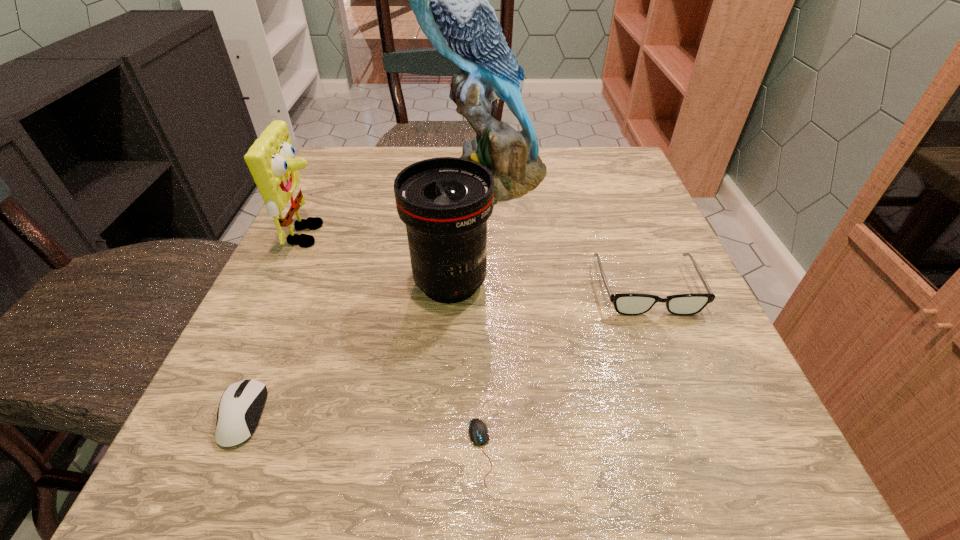
Where is `vacant area that lies between the tallest object and the left mouse`? This screenshot has width=960, height=540. vacant area that lies between the tallest object and the left mouse is located at coordinates (365, 298).

At what (x,y) coordinates should I click in order to perform the action: click on vacant area that lies between the shortest object and the third shortest object. Please return your answer as a coordinate pair (x, y). Image resolution: width=960 pixels, height=540 pixels. Looking at the image, I should click on (564, 370).

The height and width of the screenshot is (540, 960). What are the coordinates of `unoccupied position between the right mouse and the sponge` in the screenshot? It's located at (395, 343).

You are a GUI agent. You are given a task and a screenshot of the screen. Output one action in this format:
    pyautogui.click(x=<x>, y=<y>)
    Task: Click on the empty space that is in between the fifth tallest object and the shortest object
    This screenshot has height=540, width=960.
    Given the screenshot: What is the action you would take?
    pyautogui.click(x=361, y=434)

Where is `vacant region between the telephoto lens and the sponge`? The image size is (960, 540). vacant region between the telephoto lens and the sponge is located at coordinates (380, 259).

Image resolution: width=960 pixels, height=540 pixels. In order to click on object that is the nearest to the left mouse in this screenshot , I will do `click(445, 202)`.

Locate an element on the screen. Image resolution: width=960 pixels, height=540 pixels. the fourth closest object relative to the farthest object is located at coordinates (241, 404).

You are a GUI agent. You are given a task and a screenshot of the screen. Output one action in this format:
    pyautogui.click(x=<x>, y=<y>)
    Task: Click on the free region that satisfies the following two spatial constraints: 1. on the front side of the right mouse; 2. on the right side of the taller mouse
    
    Given the screenshot: What is the action you would take?
    pyautogui.click(x=227, y=452)

Find the location of a particular element. This screenshot has height=540, width=960. vacant position in the image that satisfies the following two spatial constraints: 1. on the face of the fifth tallest object; 2. on the right side of the sponge is located at coordinates pos(227,415).

Where is `free spot that satisfies the following two spatial constraints: 1. on the face of the sponge; 2. on the right side of the shortest object`? free spot that satisfies the following two spatial constraints: 1. on the face of the sponge; 2. on the right side of the shortest object is located at coordinates (210, 452).